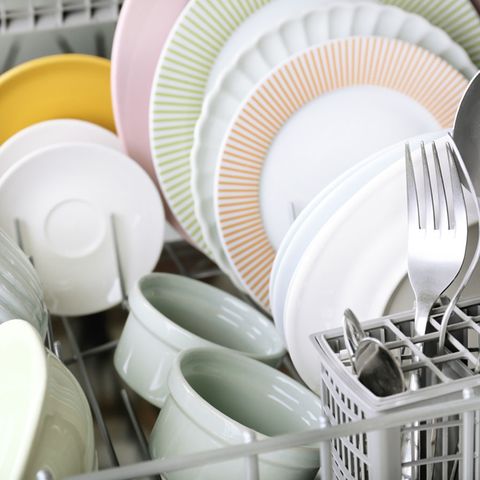
The width and height of the screenshot is (480, 480). Find the location of `bowls/ramekins`. bowls/ramekins is located at coordinates (20, 279), (31, 380), (128, 350), (206, 411).